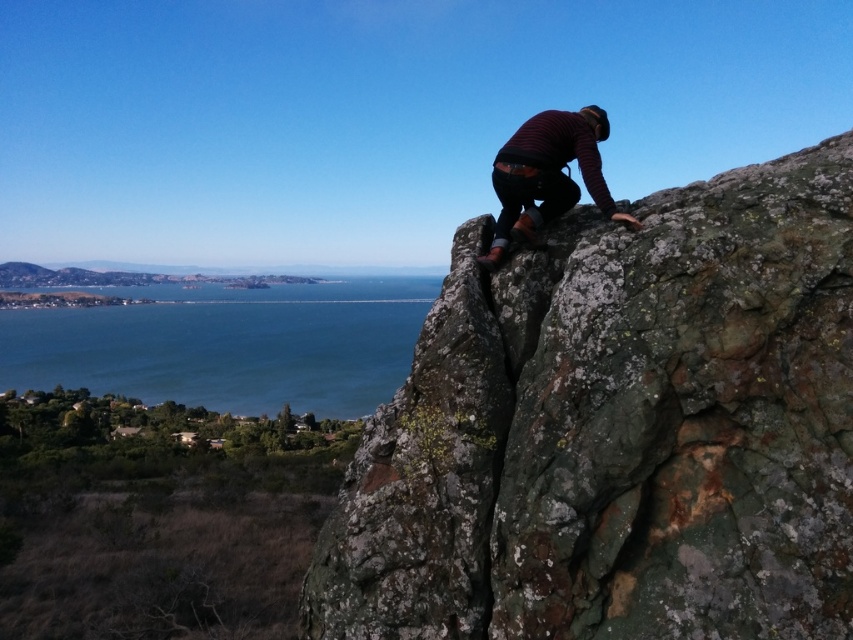
Question: Which object is closer to the camera taking this photo?

Choices:
 (A) rusty rock at upper right
 (B) striped wool sweater at upper right
 (C) blue water at lower left

Answer: (A)

Question: Is rusty rock at upper right closer to camera compared to striped wool sweater at upper right?

Choices:
 (A) no
 (B) yes

Answer: (B)

Question: Based on their relative distances, which object is farther from the striped wool sweater at upper right?

Choices:
 (A) rusty rock at upper right
 (B) blue water at lower left

Answer: (B)

Question: Is rusty rock at upper right to the left of striped wool sweater at upper right from the viewer's perspective?

Choices:
 (A) yes
 (B) no

Answer: (B)

Question: Is blue water at lower left to the right of striped wool sweater at upper right from the viewer's perspective?

Choices:
 (A) yes
 (B) no

Answer: (B)

Question: Which point appears closest to the camera in this image?

Choices:
 (A) (570, 156)
 (B) (817, 625)

Answer: (B)